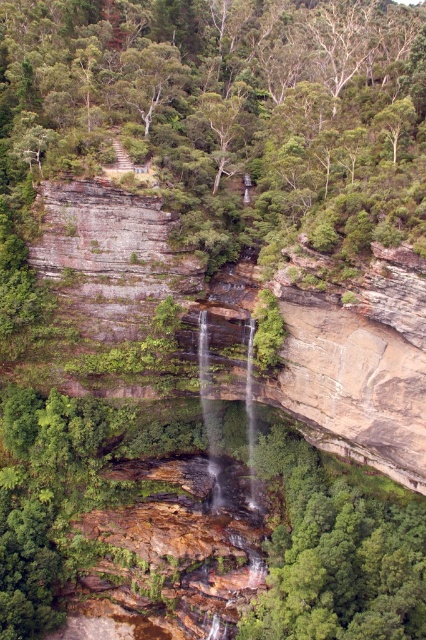
Question: Which object is closer to the camera taking this photo?

Choices:
 (A) brown rough cliff at center
 (B) green leafy tree at center

Answer: (B)

Question: Is green leafy tree at center closer to camera compared to brown rough cliff at center?

Choices:
 (A) no
 (B) yes

Answer: (B)

Question: Is green leafy tree at center bigger than brown rough cliff at center?

Choices:
 (A) yes
 (B) no

Answer: (A)

Question: Is green leafy tree at center further to camera compared to brown rough cliff at center?

Choices:
 (A) yes
 (B) no

Answer: (B)

Question: Which object is closer to the camera taking this photo?

Choices:
 (A) green leafy tree at center
 (B) brown rough cliff at center

Answer: (A)